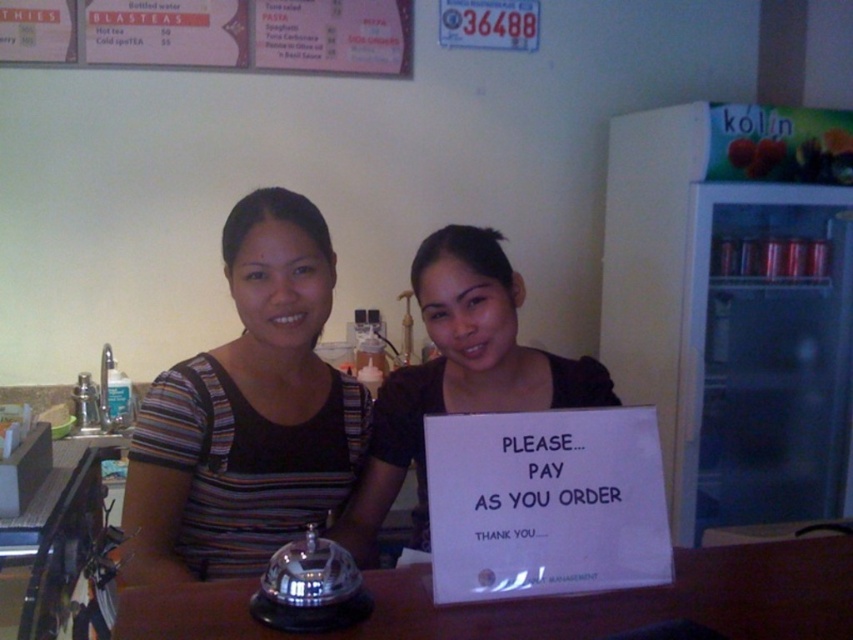
You are a customer at a cafe and want to read the menu. The brown wooden table at center is in your way. Can you move the pink paper menu at upper center to the right to see it better?

The brown wooden table at center is positioned under the pink paper menu at upper center, so moving the menu to the right might allow you to see it better by shifting it away from the table.

You are a customer at this counter and want to order from the pink paper menu at upper center. The striped fabric shirt at center is in your way. Can you move to the left to access the menu?

Yes, since the striped fabric shirt at center is to the right of the pink paper menu at upper center, moving to the left would allow you to access the menu without obstruction.

Based on the coordinates provided, which object is located at point (247, 413)?

The striped fabric shirt at center is located at point (247, 413).